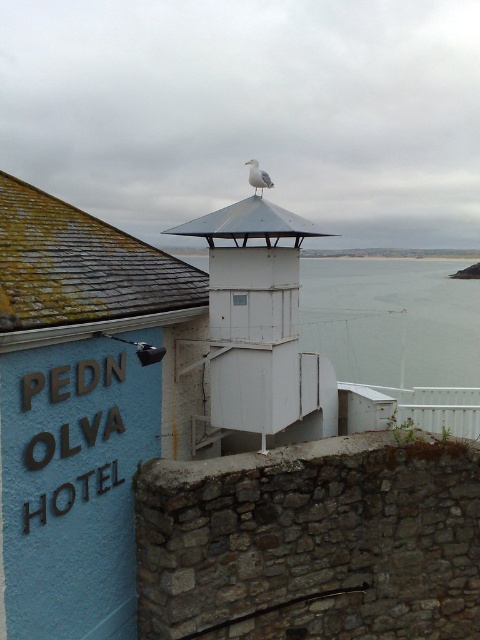
Question: Can you confirm if white matte tower at center is bigger than white feathered bird at upper center?

Choices:
 (A) no
 (B) yes

Answer: (B)

Question: Which point is closer to the camera taking this photo?

Choices:
 (A) (261, 177)
 (B) (252, 200)

Answer: (A)

Question: Is transparent glass water at center wider than white feathered bird at upper center?

Choices:
 (A) yes
 (B) no

Answer: (A)

Question: Considering the real-world distances, which object is farthest from the transparent glass water at center?

Choices:
 (A) white matte tower at center
 (B) white feathered bird at upper center

Answer: (B)

Question: Is transparent glass water at center thinner than white feathered bird at upper center?

Choices:
 (A) yes
 (B) no

Answer: (B)

Question: Which point is closer to the camera?

Choices:
 (A) white matte tower at center
 (B) white feathered bird at upper center
 (C) transparent glass water at center

Answer: (A)